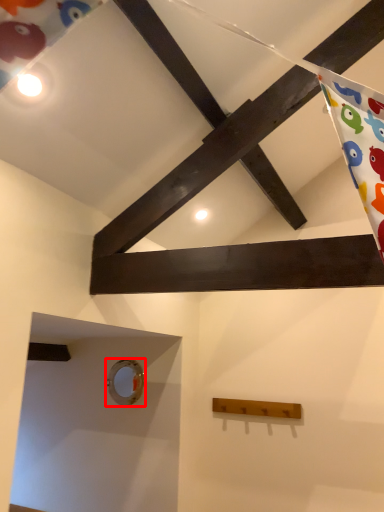
Question: Where is hole (annotated by the red box) located in relation to plank in the image?

Choices:
 (A) right
 (B) left

Answer: (B)